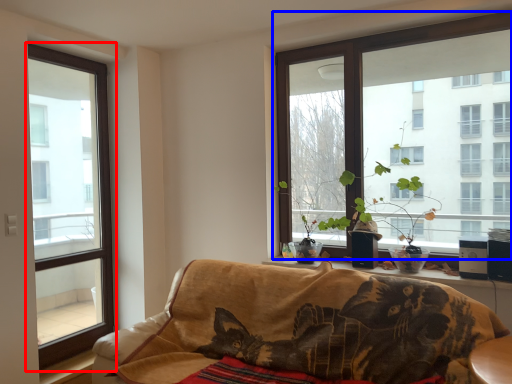
Question: Which of the following is the closest to the observer, window (highlighted by a red box) or window (highlighted by a blue box)?

Choices:
 (A) window
 (B) window

Answer: (B)